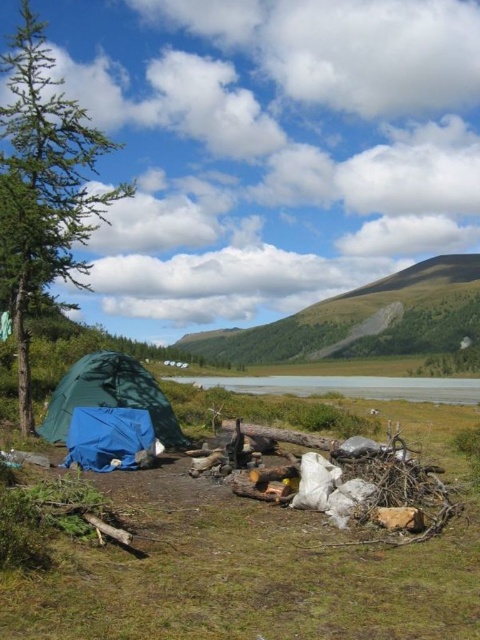
Does point (291, 394) come in front of point (99, 432)?

No, (291, 394) is further to viewer.

In order to click on transparent blue water at center in this screenshot , I will do `click(348, 387)`.

The height and width of the screenshot is (640, 480). Identify the location of transparent blue water at center. [348, 387].

Which is behind, point (156, 412) or point (106, 419)?

Point (156, 412)

Locate an element on the screen. green fabric tent at center is located at coordinates (109, 396).

Measure the distance between point (155, 378) and camera.

Point (155, 378) is 46.93 meters from camera.

This screenshot has width=480, height=640. I want to click on green fabric tent at center, so click(x=109, y=396).

Can you confirm if green fabric tent at center is taller than transparent blue water at center?

In fact, green fabric tent at center may be shorter than transparent blue water at center.

Is point (144, 374) farther from viewer compared to point (386, 380)?

No, (144, 374) is closer to viewer.

The width and height of the screenshot is (480, 640). I want to click on green fabric tent at center, so click(109, 396).